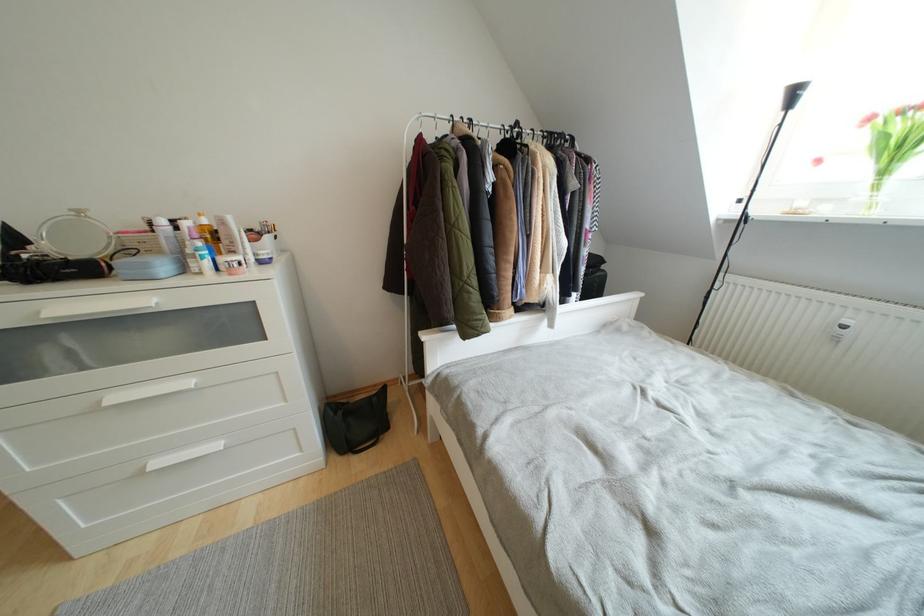
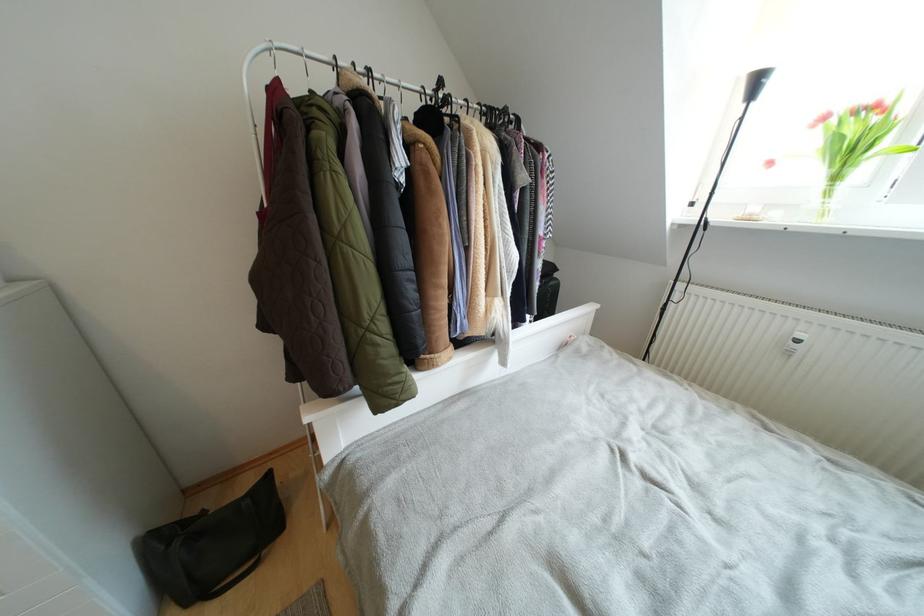
The point at (890, 176) is marked in the first image. Where is the corresponding point in the second image?

(840, 182)